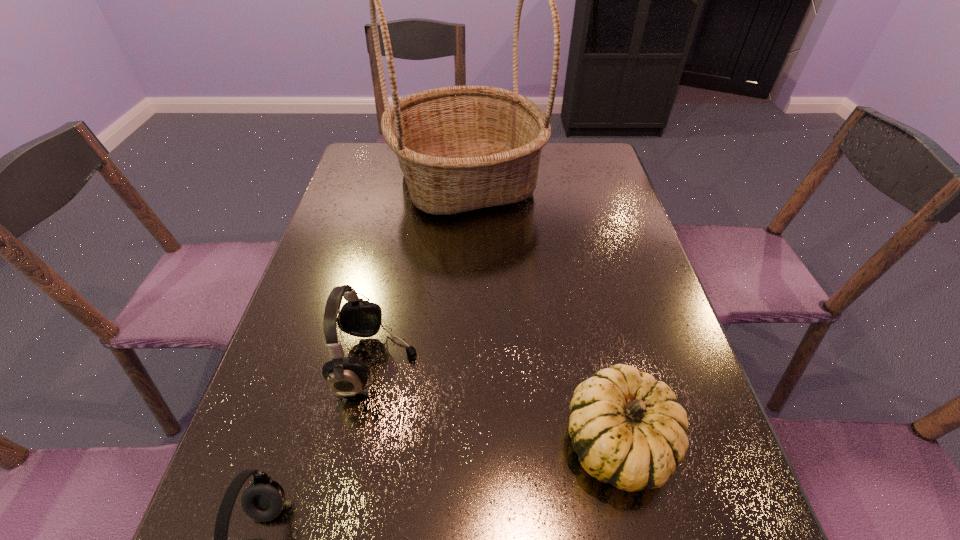
This screenshot has width=960, height=540. I want to click on vacant space that satisfies the following two spatial constraints: 1. with the microphone on the side of the gourd; 2. on the left side of the second tallest object, so click(x=362, y=442).